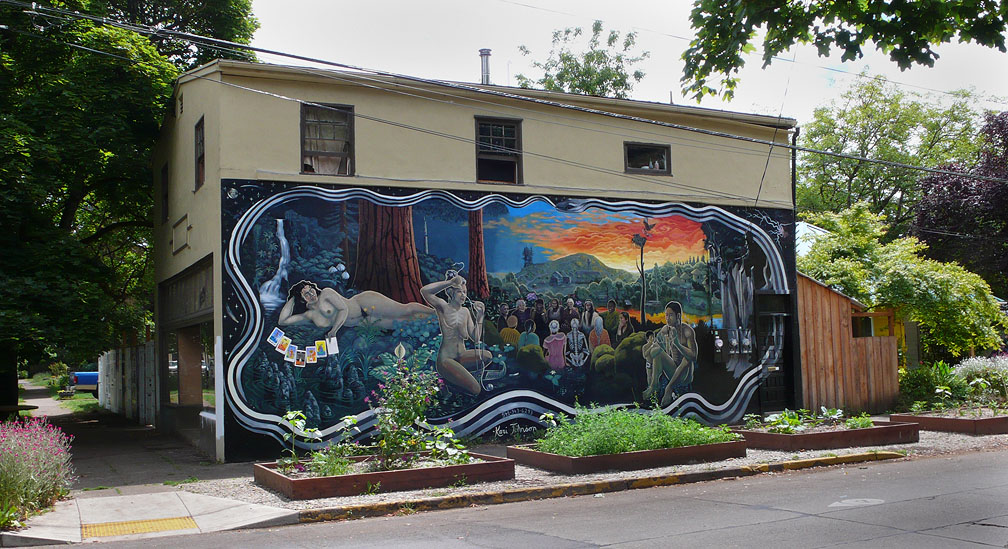
Identify the location of electric wires. click(x=275, y=47), click(x=272, y=89), click(x=791, y=148), click(x=816, y=66), click(x=784, y=200), click(x=926, y=87).